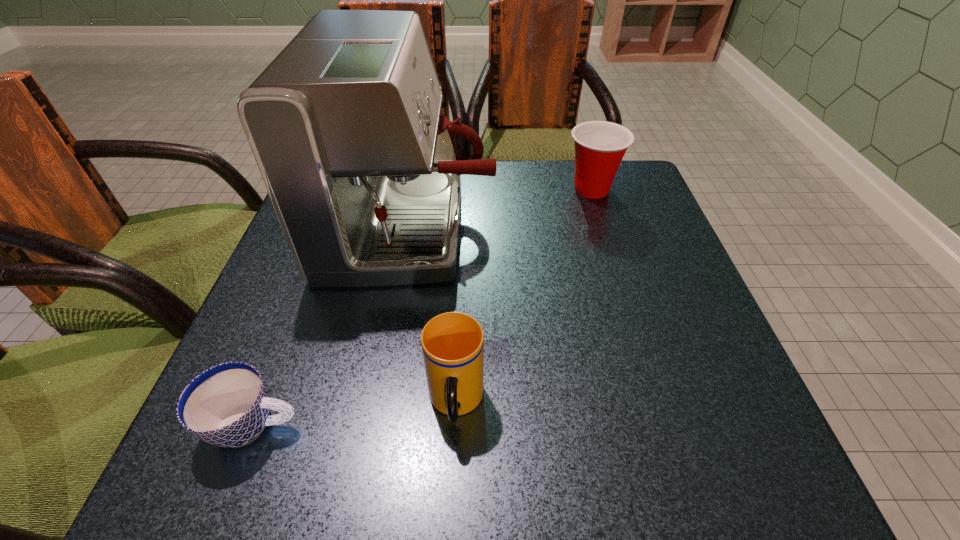
I want to click on vacant area in the image that satisfies the following two spatial constraints: 1. on the front side of the rightmost cup; 2. on the front of the tallest object near the spout, so click(604, 228).